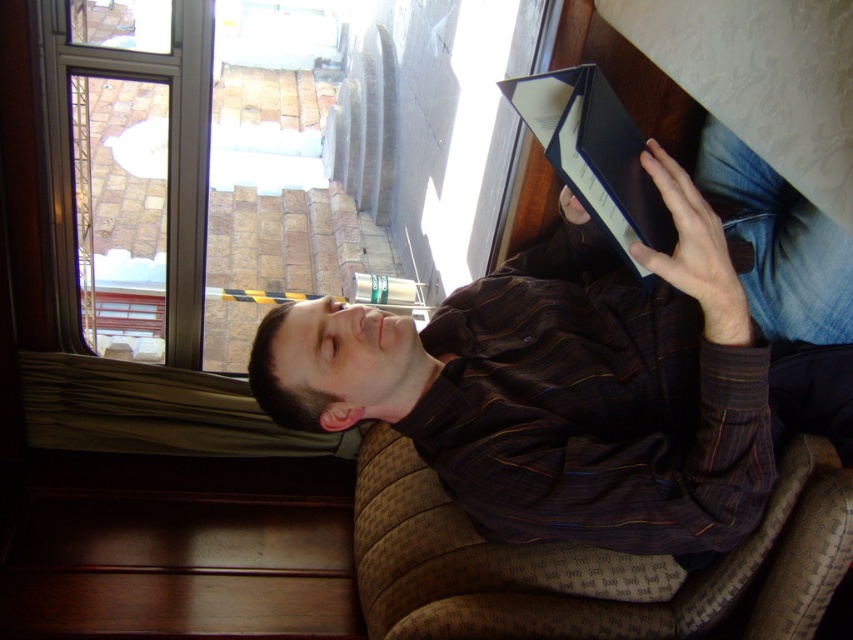
You are a photographer trying to capture a candid shot of the person in the scene. The camera is placed 3.76 feet away from the brown striped shirt at center. Is the distance sufficient to capture the entire person in the frame without moving the camera?

The camera is placed 3.76 feet away from the brown striped shirt at center. This distance may be sufficient to capture the entire person in the frame, but it depends on the camera lens and zoom settings. If using a standard lens, this distance could work, but a wider angle might be needed for a full body shot.

You are a photographer trying to capture the view outside the clear glass window at upper left while standing near the brown striped shirt at upper center. Can you see the window clearly from your current position?

The clear glass window at upper left is positioned on the left side of brown striped shirt at upper center, so yes, you can see the window clearly from your current position as it is to your left.